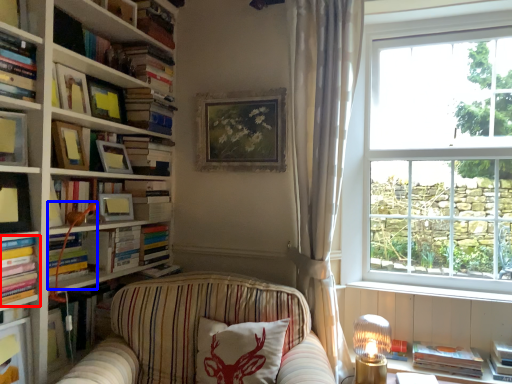
Question: Which object is closer to the camera taking this photo, book (highlighted by a red box) or lamp (highlighted by a blue box)?

Choices:
 (A) book
 (B) lamp

Answer: (A)